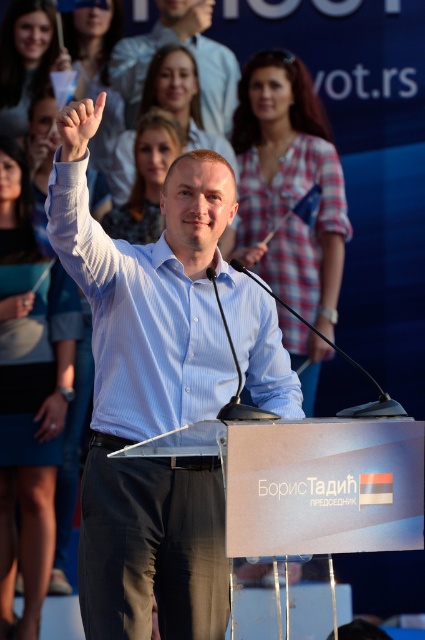
You are a photographer at the event. You need to capture a clear photo of the plaid fabric shirt at upper center and the matte black hand at upper left. Which object is located to the right of the other?

The plaid fabric shirt at upper center is positioned on the right side of matte black hand at upper left.

You are a photographer at the event and want to capture a closeup of the matte blue shirt at center and the matte black hand at upper left in the same frame. Will the shirt and hand fit vertically in the frame if the shirt is shorter than the hand?

The matte blue shirt at center is shorter than the matte black hand at upper left, so the hand is taller. Since the shirt is shorter, the hand may extend beyond the frame if both are included vertically. Adjust the camera angle or zoom to ensure both fit.